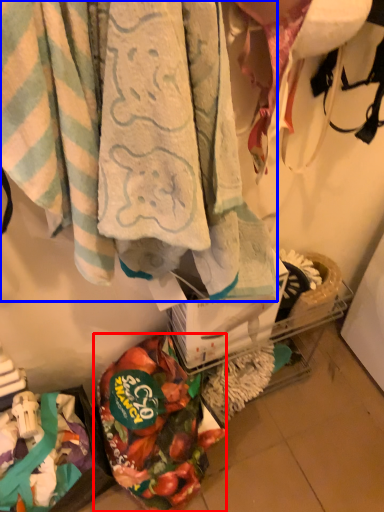
Question: Which of the following is the closest to the observer, food (highlighted by a red box) or towel (highlighted by a blue box)?

Choices:
 (A) food
 (B) towel

Answer: (B)